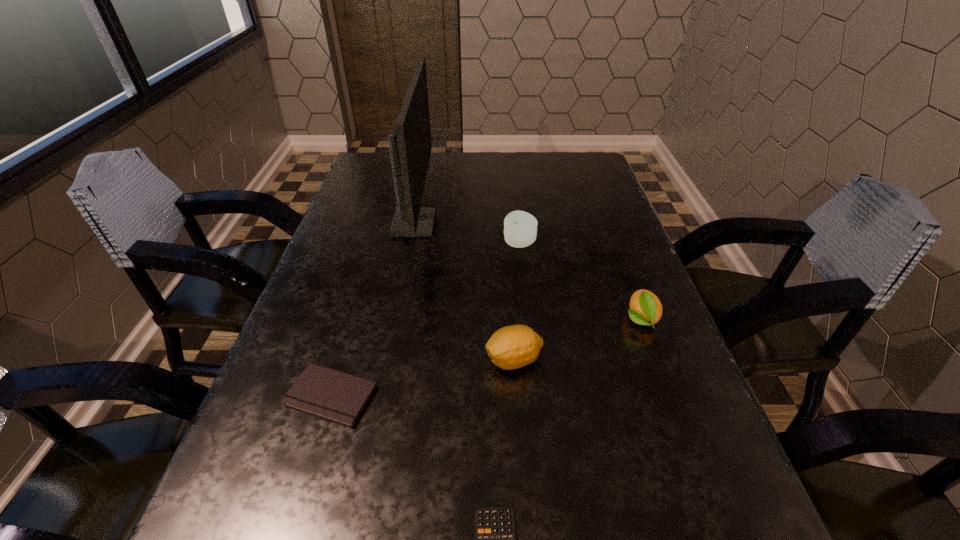
You are a GUI agent. You are given a task and a screenshot of the screen. Output one action in this format:
    pyautogui.click(x=<x>, y=<y>)
    Task: Click on the vacant region that satisfies the following two spatial constraints: 1. on the front side of the apple; 2. at the stem end of the nearer lemon
    Image resolution: width=960 pixels, height=540 pixels.
    Given the screenshot: What is the action you would take?
    pyautogui.click(x=533, y=360)

The image size is (960, 540). I want to click on free location that satisfies the following two spatial constraints: 1. on the front-facing side of the apple; 2. on the right side of the tallest object, so click(410, 244).

You are a GUI agent. You are given a task and a screenshot of the screen. Output one action in this format:
    pyautogui.click(x=<x>, y=<y>)
    Task: Click on the free space that satisfies the following two spatial constraints: 1. on the front-facing side of the tallest object; 2. on the back side of the apple
    Image resolution: width=960 pixels, height=540 pixels.
    Given the screenshot: What is the action you would take?
    pos(410,244)

Identify the location of vacant space that satisfies the following two spatial constraints: 1. on the front-facing side of the computer monitor; 2. on the back side of the apple. This screenshot has width=960, height=540. (410, 244).

The height and width of the screenshot is (540, 960). I want to click on vacant space that satisfies the following two spatial constraints: 1. with leaves positioned above the fourth nearest object; 2. at the stem end of the nearer lemon, so click(x=656, y=360).